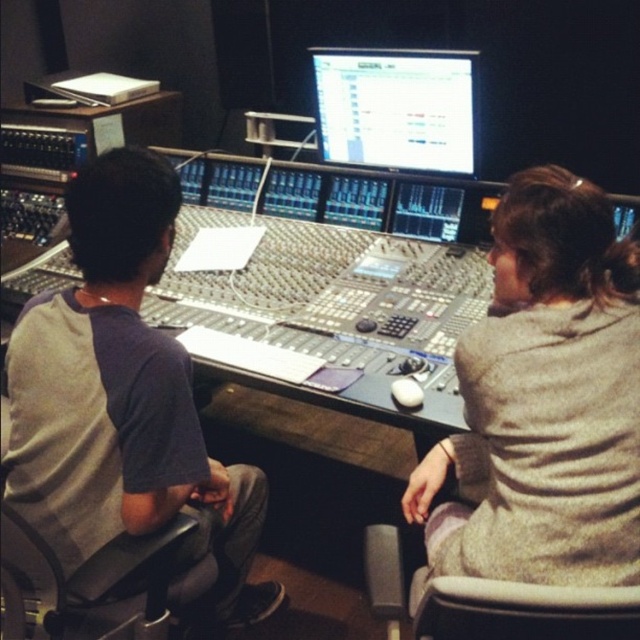
Question: Is gray wool sweater at right behind gray cotton shirt at left?

Choices:
 (A) no
 (B) yes

Answer: (A)

Question: Is gray wool sweater at right closer to the viewer compared to matte black monitor at center?

Choices:
 (A) no
 (B) yes

Answer: (B)

Question: Which object appears closest to the camera in this image?

Choices:
 (A) gray cotton shirt at left
 (B) matte black monitor at center

Answer: (A)

Question: Estimate the real-world distances between objects in this image. Which object is farther from the matte black monitor at center?

Choices:
 (A) gray cotton shirt at left
 (B) gray wool sweater at right

Answer: (A)

Question: Is gray wool sweater at right to the left of gray cotton shirt at left from the viewer's perspective?

Choices:
 (A) yes
 (B) no

Answer: (B)

Question: Which point appears closest to the camera in this image?

Choices:
 (A) (371, 58)
 (B) (131, 218)
 (C) (428, 483)

Answer: (B)